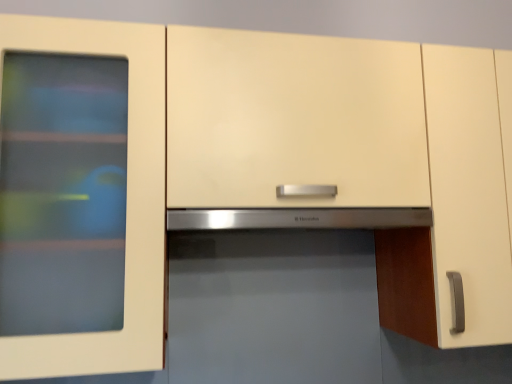
Question: Considering the positions of point (202, 226) and point (349, 306), is point (202, 226) closer or farther from the camera than point (349, 306)?

Choices:
 (A) farther
 (B) closer

Answer: (B)

Question: Considering the relative positions of stainless steel exhaust hood at center and satin stainless steel microwave at center in the image provided, is stainless steel exhaust hood at center to the left or to the right of satin stainless steel microwave at center?

Choices:
 (A) left
 (B) right

Answer: (A)

Question: Is stainless steel exhaust hood at center situated inside satin stainless steel microwave at center or outside?

Choices:
 (A) inside
 (B) outside

Answer: (B)

Question: Is satin stainless steel microwave at center inside the boundaries of stainless steel exhaust hood at center, or outside?

Choices:
 (A) inside
 (B) outside

Answer: (B)

Question: Is point (334, 263) closer or farther from the camera than point (187, 213)?

Choices:
 (A) farther
 (B) closer

Answer: (A)

Question: In terms of height, does satin stainless steel microwave at center look taller or shorter compared to stainless steel exhaust hood at center?

Choices:
 (A) tall
 (B) short

Answer: (A)

Question: In terms of width, does satin stainless steel microwave at center look wider or thinner when compared to stainless steel exhaust hood at center?

Choices:
 (A) wide
 (B) thin

Answer: (A)